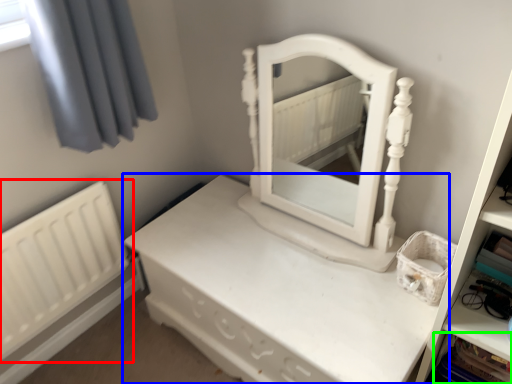
Question: Estimate the real-world distances between objects in this image. Which object is closer to radiator (highlighted by a red box), nightstand (highlighted by a blue box) or cabinet (highlighted by a green box)?

Choices:
 (A) nightstand
 (B) cabinet

Answer: (A)